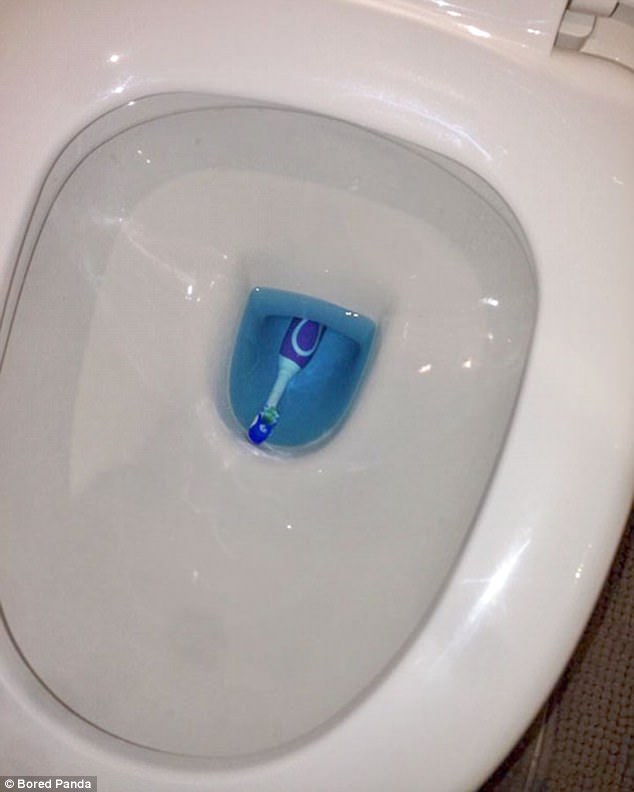
At what (x,y) coordinates should I click in order to perform the action: click on rug. Please return your answer as a coordinate pair (x, y). The height and width of the screenshot is (792, 634). Looking at the image, I should click on (584, 737).